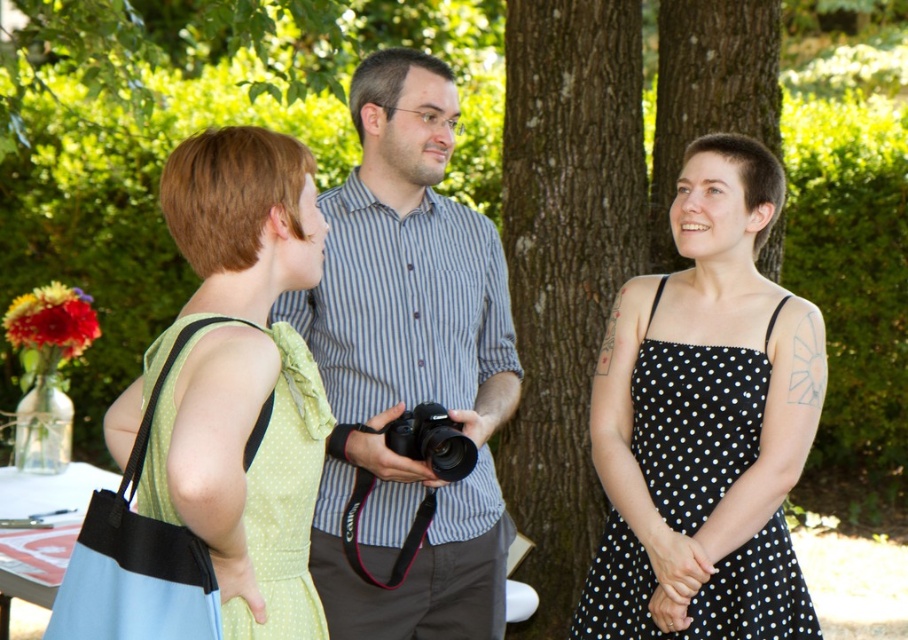
Between point (390, 227) and point (245, 518), which one is positioned behind?

The point (390, 227) is more distant.

Between striped cotton shirt at center and green polka dot fabric dress at left, which one is positioned higher?

striped cotton shirt at center

The image size is (908, 640). In order to click on striped cotton shirt at center in this screenshot , I will do `click(408, 365)`.

Is striped cotton shirt at center positioned behind brown rough bark tree at center?

That is False.

In the scene shown: Does striped cotton shirt at center have a greater width compared to brown rough bark tree at center?

Yes, striped cotton shirt at center is wider than brown rough bark tree at center.

In the scene shown: Measure the distance between point (383, 570) and camera.

They are 9.81 feet apart.

The width and height of the screenshot is (908, 640). Identify the location of striped cotton shirt at center. (408, 365).

Does brown rough bark tree at center have a larger size compared to black polka dot fabric dress at center?

Correct, brown rough bark tree at center is larger in size than black polka dot fabric dress at center.

Does brown rough bark tree at center appear under black polka dot fabric dress at center?

Incorrect, brown rough bark tree at center is not positioned below black polka dot fabric dress at center.

The image size is (908, 640). I want to click on brown rough bark tree at center, so click(x=565, y=266).